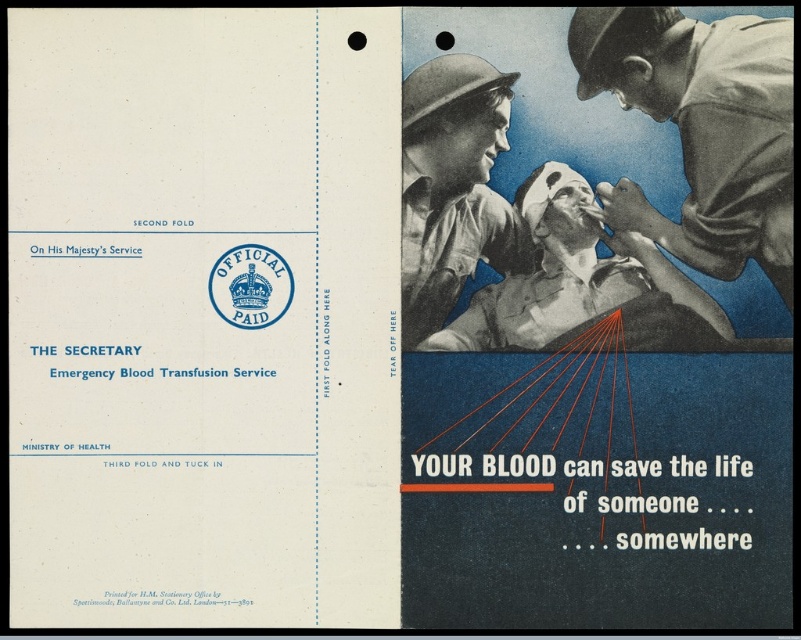
In the scene shown: You are examining a vintage postcard from the mid 20th century promoting blood donation. You notice a blue uniform shirt at upper right and a matte gray uniform at center. Which uniform is taller?

The blue uniform shirt at upper right is taller than the matte gray uniform at center.

You are a postal worker sorting mail and notice a vintage card with a point marked at coordinates (592, 68). The card has an official stamp on the left and text about emergency blood services. If the point is 5.22 feet away from you, can you reach it without moving your hand more than 5 feet?

The point at coordinates (592, 68) is 5.22 feet away from you, so reaching it would require extending your hand more than 5 feet. Therefore, you cannot reach it without moving your hand more than 5 feet.

You are examining a vintage postcard and notice two uniforms. The blue uniform shirt at upper right and the matte khaki uniform at center. Which uniform is positioned more to the right?

The blue uniform shirt at upper right is positioned more to the right than the matte khaki uniform at center.